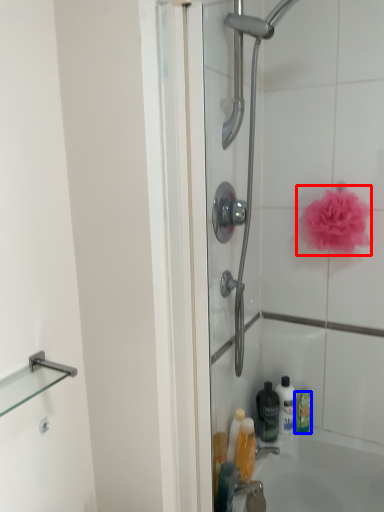
Question: Which point is closer to the camera, rose (highlighted by a red box) or cleaning product (highlighted by a blue box)?

Choices:
 (A) rose
 (B) cleaning product

Answer: (A)